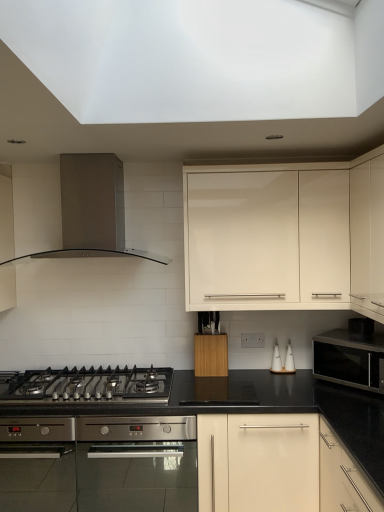
Question: Is white ceramic salt shaker at center-right, the first appliance when ordered from left to right, spatially inside wooden block at center, the 3th cabinetry in the right-to-left sequence, or outside of it?

Choices:
 (A) outside
 (B) inside

Answer: (A)

Question: From a real-world perspective, is white ceramic salt shaker at center-right, the first appliance when ordered from left to right, physically located above or below wooden block at center, the 3th cabinetry in the right-to-left sequence?

Choices:
 (A) below
 (B) above

Answer: (A)

Question: Estimate the real-world distances between objects in this image. Which object is closer to the satin black microwave at right?

Choices:
 (A) white ceramic salt shaker at center-right, the first appliance when ordered from left to right
 (B) stainless steel oven at center
 (C) white ceramic salt and pepper shakers at center-right, the second appliance viewed from the left
 (D) white glossy cabinet at upper center, placed as the 2th cabinetry when sorted from right to left
 (E) wooden block at center, the 3th cabinetry in the right-to-left sequence

Answer: (C)

Question: Which object is the farthest from the matte cream cabinet at upper right, the first cabinetry from the right?

Choices:
 (A) stainless steel range hood at upper left
 (B) white glossy cabinet at upper center, the second cabinetry viewed from the left
 (C) black stainless steel gas stove at lower left
 (D) wooden block at center, the first cabinetry positioned from the left
 (E) stainless steel oven at center

Answer: (C)